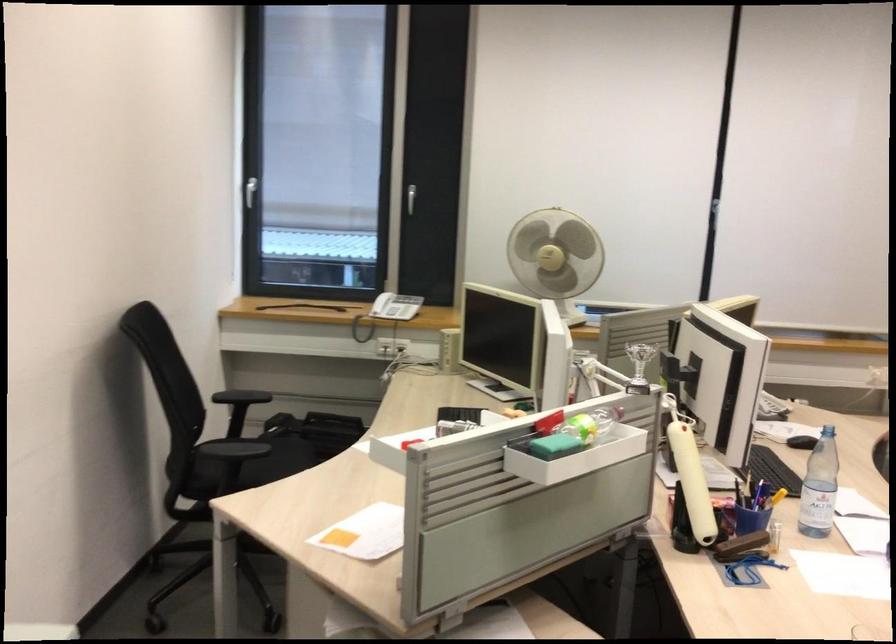
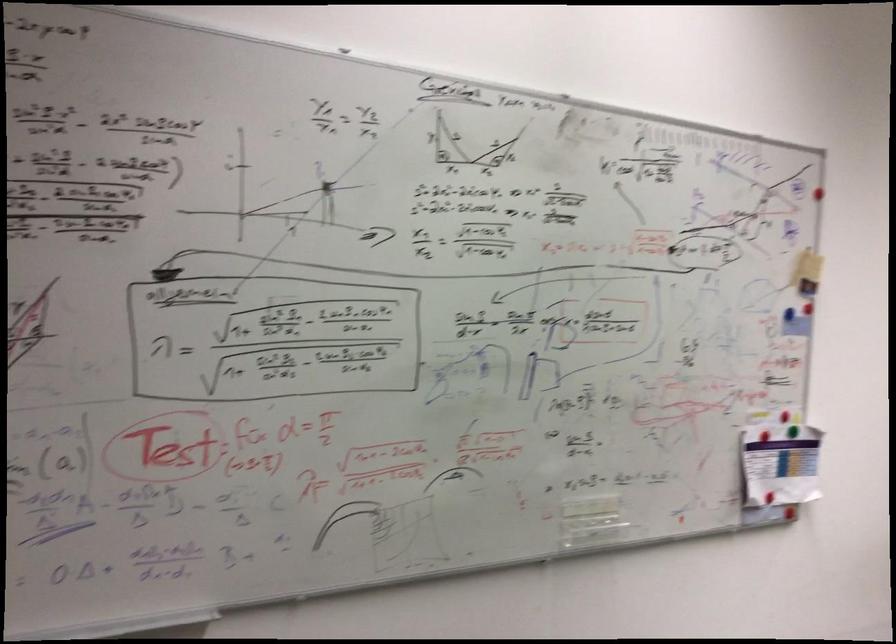
Question: How did the camera likely rotate?

Choices:
 (A) Left
 (B) Right
 (C) Up
 (D) Down

Answer: (A)